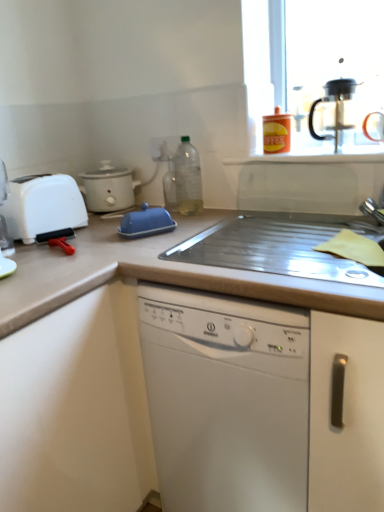
Question: Are metallic silver sink at center, which is the 2th countertop in bottom-to-top order, and beige laminate countertop at center, which appears as the 2th countertop when viewed from the top, making contact?

Choices:
 (A) yes
 (B) no

Answer: (B)

Question: Is metallic silver sink at center, which is the 2th countertop in bottom-to-top order, oriented away from beige laminate countertop at center, which appears as the 2th countertop when viewed from the top?

Choices:
 (A) no
 (B) yes

Answer: (B)

Question: Is the position of metallic silver sink at center, which is the 2th countertop in bottom-to-top order, less distant than that of beige laminate countertop at center, which appears as the 2th countertop when viewed from the top?

Choices:
 (A) no
 (B) yes

Answer: (A)

Question: From a real-world perspective, is metallic silver sink at center, acting as the 1th countertop starting from the top, under beige laminate countertop at center, which appears as the 2th countertop when viewed from the top?

Choices:
 (A) yes
 (B) no

Answer: (B)

Question: Does metallic silver sink at center, acting as the 1th countertop starting from the top, have a smaller size compared to beige laminate countertop at center, which appears as the 2th countertop when viewed from the top?

Choices:
 (A) no
 (B) yes

Answer: (B)

Question: Is beige laminate countertop at center, which appears as the 2th countertop when viewed from the top, located within metallic silver sink at center, acting as the 1th countertop starting from the top?

Choices:
 (A) no
 (B) yes

Answer: (A)

Question: Could you tell me if translucent plastic bottle at center is turned towards white plastic toaster at left?

Choices:
 (A) yes
 (B) no

Answer: (B)

Question: Can you confirm if translucent plastic bottle at center is smaller than white plastic toaster at left?

Choices:
 (A) no
 (B) yes

Answer: (B)

Question: Are translucent plastic bottle at center and white plastic toaster at left far apart?

Choices:
 (A) no
 (B) yes

Answer: (A)

Question: Considering the relative sizes of translucent plastic bottle at center and white plastic toaster at left in the image provided, is translucent plastic bottle at center bigger than white plastic toaster at left?

Choices:
 (A) no
 (B) yes

Answer: (A)

Question: Considering the relative sizes of translucent plastic bottle at center and white plastic toaster at left in the image provided, is translucent plastic bottle at center taller than white plastic toaster at left?

Choices:
 (A) no
 (B) yes

Answer: (B)

Question: Is translucent plastic bottle at center touching white plastic toaster at left?

Choices:
 (A) yes
 (B) no

Answer: (B)

Question: From a real-world perspective, is black plastic coffee machine at upper right under beige laminate countertop at center, which is the 1th countertop in bottom-to-top order?

Choices:
 (A) yes
 (B) no

Answer: (B)